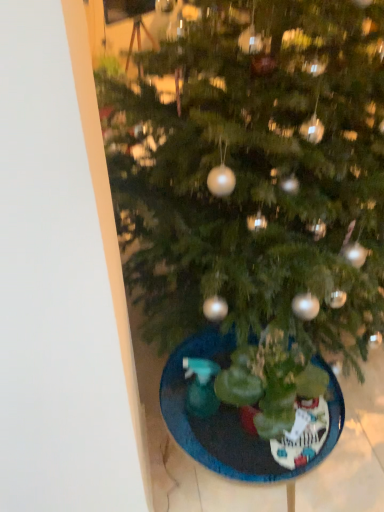
Image resolution: width=384 pixels, height=512 pixels. I want to click on vacant space underneath green matte plant at center (from a real-world perspective), so click(242, 430).